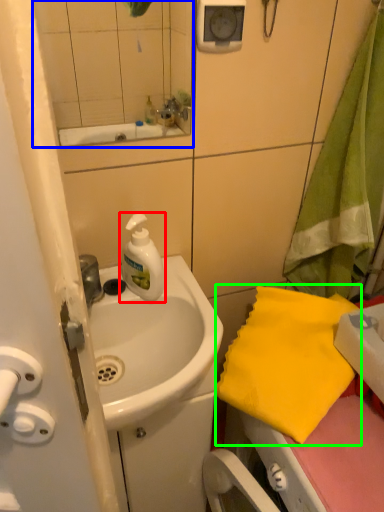
Question: Which object is the farthest from cleaning product (highlighted by a red box)? Choose among these: mirror (highlighted by a blue box) or beach towel (highlighted by a green box).

Choices:
 (A) mirror
 (B) beach towel

Answer: (B)